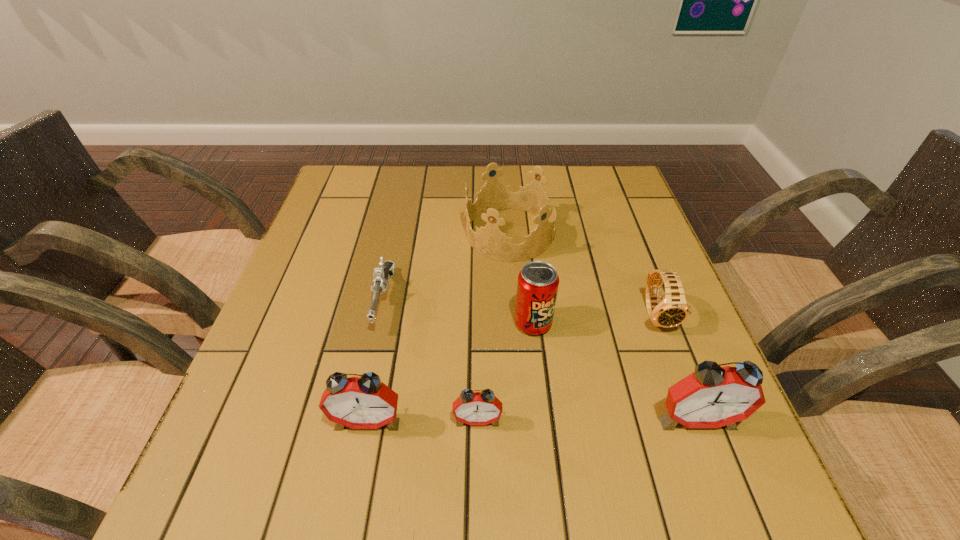
The image size is (960, 540). In the image, there is a desktop. Identify the location of vacant space at the right edge. (649, 319).

Where is `vacant space at the far left corner`? The width and height of the screenshot is (960, 540). vacant space at the far left corner is located at coordinates (365, 183).

This screenshot has height=540, width=960. Find the location of `vacant space at the far right corner`. vacant space at the far right corner is located at coordinates (588, 181).

In the image, there is a desktop. Where is `vacant space at the near right corner`? Image resolution: width=960 pixels, height=540 pixels. vacant space at the near right corner is located at coordinates (666, 413).

Where is `unoccupied position between the shortest alarm clock and the rightmost alarm clock`? unoccupied position between the shortest alarm clock and the rightmost alarm clock is located at coordinates (587, 420).

At what (x,y) coordinates should I click in order to perform the action: click on free space between the farthest object and the rightmost alarm clock. Please return your answer as a coordinate pair (x, y). This screenshot has width=960, height=540. Looking at the image, I should click on (603, 326).

This screenshot has height=540, width=960. I want to click on blank region between the rightmost alarm clock and the leftmost alarm clock, so click(532, 420).

Identify the location of unoccupied position between the gun and the tiara. (446, 267).

Where is `free space between the second tallest alarm clock and the soda can`? free space between the second tallest alarm clock and the soda can is located at coordinates (450, 372).

This screenshot has width=960, height=540. What are the coordinates of `free spot between the tiara and the gun` in the screenshot? It's located at (446, 267).